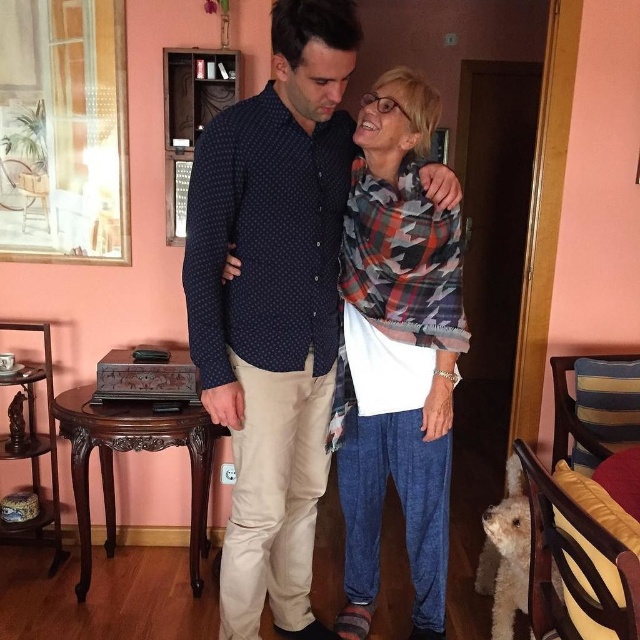
Which is more to the right, camo-patterned scarf at center or white fluffy dog at lower right?

From the viewer's perspective, white fluffy dog at lower right appears more on the right side.

Can you confirm if camo-patterned scarf at center is positioned below white fluffy dog at lower right?

No, camo-patterned scarf at center is not below white fluffy dog at lower right.

You are a GUI agent. You are given a task and a screenshot of the screen. Output one action in this format:
    pyautogui.click(x=<x>, y=<y>)
    Task: Click on the camo-patterned scarf at center
    
    Given the screenshot: What is the action you would take?
    point(397,353)

Which of these two, polka dot shirt at center or white fluffy dog at lower right, stands shorter?

With less height is white fluffy dog at lower right.

Who is more forward, (205, 269) or (509, 582)?

Point (205, 269)

Which is in front, point (241, 186) or point (500, 614)?

Point (241, 186) is in front.

Locate an element on the screen. polka dot shirt at center is located at coordinates (x=273, y=305).

Who is more forward, (253, 397) or (369, 371)?

Point (253, 397) is more forward.

Between point (257, 268) and point (368, 244), which one is positioned behind?

Positioned behind is point (368, 244).

Who is more distant from viewer, [228,564] or [380,291]?

The point [380,291] is more distant.

This screenshot has width=640, height=640. What are the coordinates of `polka dot shirt at center` in the screenshot? It's located at (273, 305).